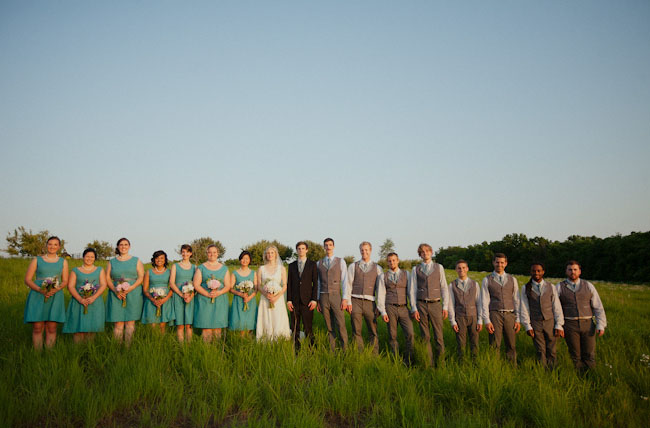
The width and height of the screenshot is (650, 428). In order to click on bouquets in this screenshot , I will do `click(43, 290)`, `click(86, 292)`, `click(121, 285)`, `click(151, 296)`, `click(187, 288)`, `click(208, 285)`, `click(240, 289)`.